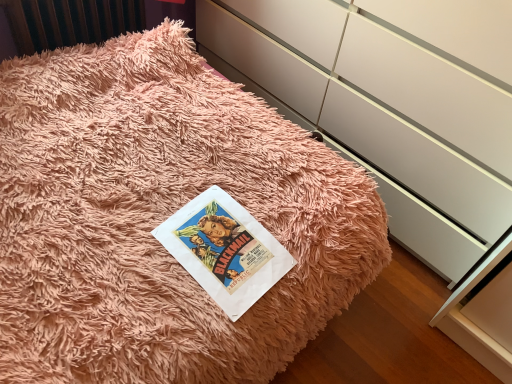
Question: Should I look upward or downward to see white glossy cabinetry at center?

Choices:
 (A) up
 (B) down

Answer: (A)

Question: Would you say vintage paper at center is a long distance from white glossy cabinetry at center?

Choices:
 (A) yes
 (B) no

Answer: (B)

Question: Does vintage paper at center have a lesser width compared to white glossy cabinetry at center?

Choices:
 (A) yes
 (B) no

Answer: (A)

Question: Can white glossy cabinetry at center be found inside vintage paper at center?

Choices:
 (A) yes
 (B) no

Answer: (B)

Question: Can you confirm if vintage paper at center is shorter than white glossy cabinetry at center?

Choices:
 (A) no
 (B) yes

Answer: (B)

Question: From a real-world perspective, is vintage paper at center located beneath white glossy cabinetry at center?

Choices:
 (A) yes
 (B) no

Answer: (A)

Question: Is the position of vintage paper at center less distant than that of white glossy cabinetry at center?

Choices:
 (A) yes
 (B) no

Answer: (B)

Question: Is white glossy cabinetry at center closer to the viewer compared to vintage paper at center?

Choices:
 (A) no
 (B) yes

Answer: (B)

Question: Is white glossy cabinetry at center turned away from vintage paper at center?

Choices:
 (A) yes
 (B) no

Answer: (B)

Question: From the image's perspective, does white glossy cabinetry at center appear lower than vintage paper at center?

Choices:
 (A) no
 (B) yes

Answer: (A)

Question: Would you say white glossy cabinetry at center contains vintage paper at center?

Choices:
 (A) yes
 (B) no

Answer: (B)

Question: From a real-world perspective, is white glossy cabinetry at center beneath vintage paper at center?

Choices:
 (A) no
 (B) yes

Answer: (A)

Question: Considering the relative positions of white glossy cabinetry at center and vintage paper at center in the image provided, is white glossy cabinetry at center to the left of vintage paper at center from the viewer's perspective?

Choices:
 (A) no
 (B) yes

Answer: (A)

Question: From a real-world perspective, relative to vintage paper at center, is white glossy cabinetry at center vertically above or below?

Choices:
 (A) above
 (B) below

Answer: (A)